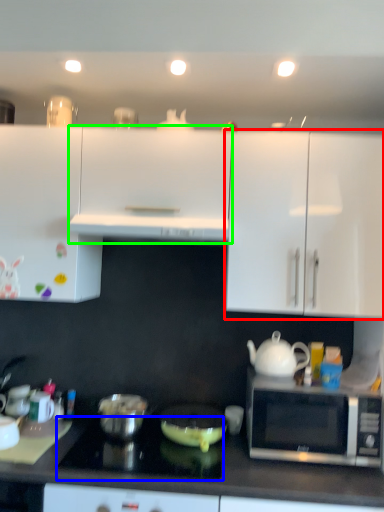
Question: Which object is the farthest from cabinetry (highlighted by a red box)? Choose among these: gas stove (highlighted by a blue box) or cabinetry (highlighted by a green box).

Choices:
 (A) gas stove
 (B) cabinetry

Answer: (A)